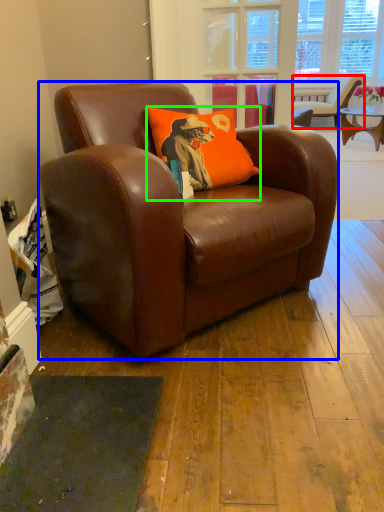
Question: Which object is positioned farthest from chair (highlighted by a red box)? Select from chair (highlighted by a blue box) and pillow (highlighted by a green box).

Choices:
 (A) chair
 (B) pillow

Answer: (A)